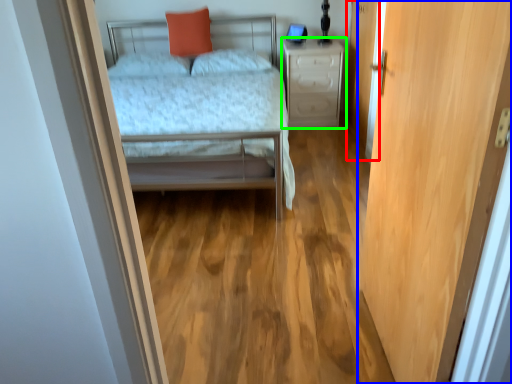
Question: Estimate the real-world distances between objects in this image. Which object is farther from screen door (highlighted by a red box), door (highlighted by a blue box) or nightstand (highlighted by a green box)?

Choices:
 (A) door
 (B) nightstand

Answer: (A)